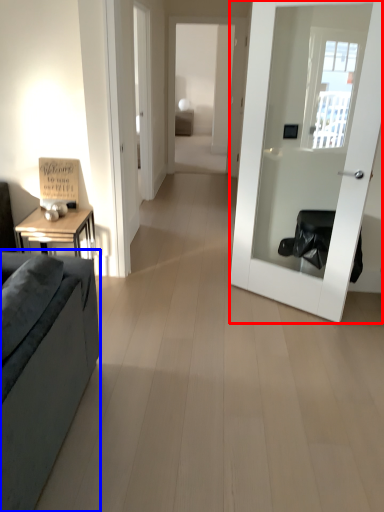
Question: Which object is further to the camera taking this photo, door (highlighted by a red box) or studio couch (highlighted by a blue box)?

Choices:
 (A) door
 (B) studio couch

Answer: (A)